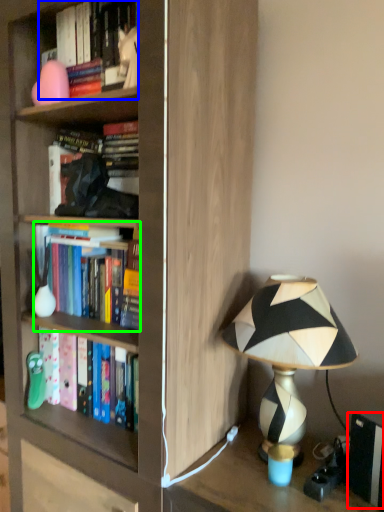
Question: Which object is the farthest from paperback book (highlighted by a red box)? Choose among these: book (highlighted by a blue box) or book (highlighted by a green box).

Choices:
 (A) book
 (B) book

Answer: (A)